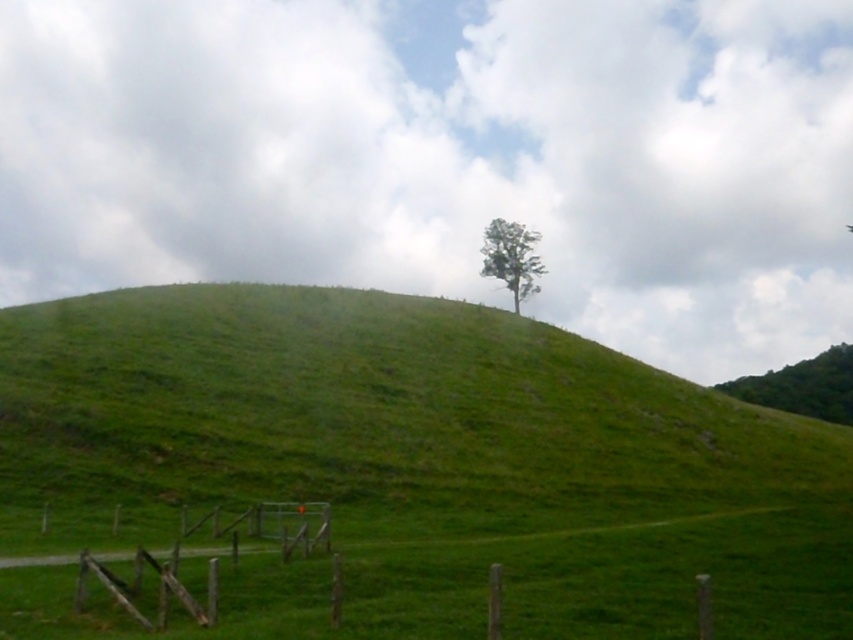
Is brown wooden fence at lower left above green leafy tree at upper right?

Indeed, brown wooden fence at lower left is positioned over green leafy tree at upper right.

Who is positioned more to the right, brown wooden fence at lower left or green leafy tree at upper right?

From the viewer's perspective, green leafy tree at upper right appears more on the right side.

Which is behind, point (90, 564) or point (750, 381)?

The point (750, 381) is behind.

This screenshot has width=853, height=640. Find the location of `brown wooden fence at lower left`. brown wooden fence at lower left is located at coordinates (143, 588).

The height and width of the screenshot is (640, 853). I want to click on green grassy hillside at center, so click(421, 464).

In the scene shown: Who is more forward, (552, 330) or (788, 406)?

Point (552, 330)

What do you see at coordinates (421, 464) in the screenshot? I see `green grassy hillside at center` at bounding box center [421, 464].

This screenshot has width=853, height=640. In order to click on green grassy hillside at center in this screenshot , I will do point(421,464).

Between point (339, 512) and point (210, 602), which one is positioned in front?

Positioned in front is point (210, 602).

What do you see at coordinates (421, 464) in the screenshot? The width and height of the screenshot is (853, 640). I see `green grassy hillside at center` at bounding box center [421, 464].

Identify the location of green grassy hillside at center. The height and width of the screenshot is (640, 853). (421, 464).